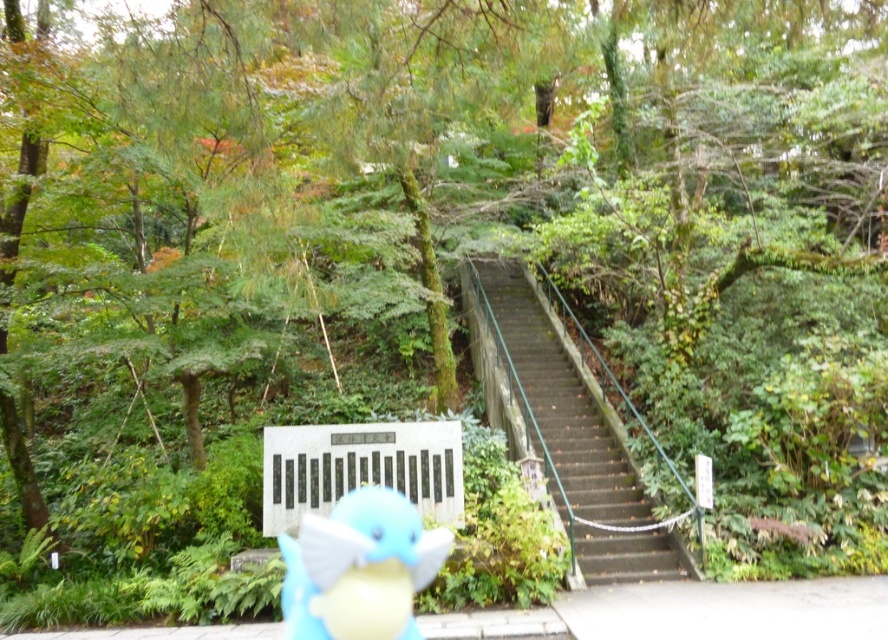
You are standing at the entrance of the park and want to reach the dark gray concrete stairs at center. According to the image, where should you look to find them?

The dark gray concrete stairs at center are located at the 2D coordinates point (563, 429) in the image.

You are standing at the bottom of the dark gray concrete stairs at center and want to place the blue plush toy at center on the top step. Can you reach it without climbing the stairs?

The dark gray concrete stairs at center is above the blue plush toy at center, so you can reach the top step by extending your arm upwards from the bottom of the stairs.

You are standing in the park and want to take a photo of the point at coordinates [512,292]. The camera you have can focus clearly up to 50 feet away. Will the point be in focus?

The distance of point [512,292] from viewer is 52.16 feet, which is beyond the camera focus range of 50 feet. The point will not be in focus.